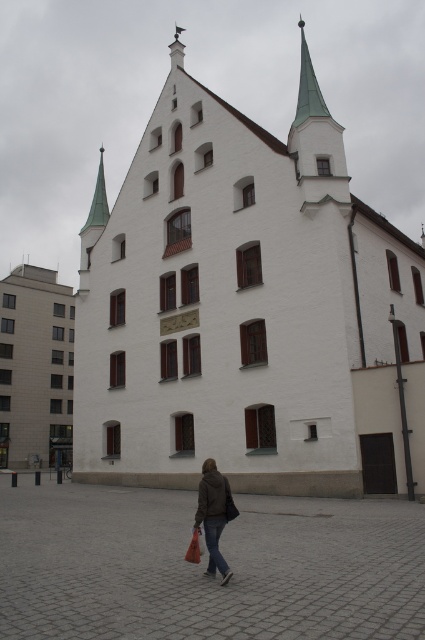
You are standing in front of the white stone church at center and the brown leather jacket at lower center. Which object is located more to the left?

The brown leather jacket at lower center is positioned more to the left than the white stone church at center.

You are an architect analyzing the building dimensions in the image. The white stone church at center and the white concrete building at left are both visible. Which one has a greater width?

The white stone church at center has a greater width than the white concrete building at left.

You are standing in front of the building and want to determine the relative positions of two points on its facade. The first point is located at coordinates point (17, 316), and the second point is at point (209, 504). Which of these points appears closer to you when looking at the building?

Point (17, 316) is further to the viewer than point (209, 504), so the first point appears closer to you.